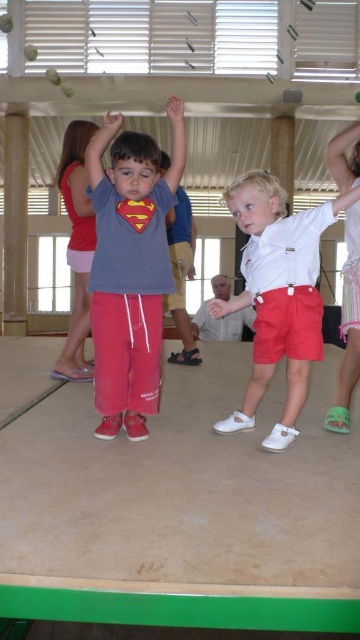
You are a photographer setting up a camera in the gymnasium. You notice the matte gray shirt at center and the white smooth shorts at center. Which object should you focus on if you want to capture the smaller one?

The matte gray shirt at center is smaller than the white smooth shorts at center, so you should focus on the matte gray shirt at center to capture the smaller one.

You are a photographer setting up a shoot in this gymnasium. You need to ensure that the matte gray shirt at center and the white smooth shorts at center are both visible in the frame. Given their sizes, which object might you need to position closer to the camera to maintain clarity?

The matte gray shirt at center is thinner than the white smooth shorts at center, so positioning the matte gray shirt at center closer to the camera would help maintain clarity due to its smaller size.